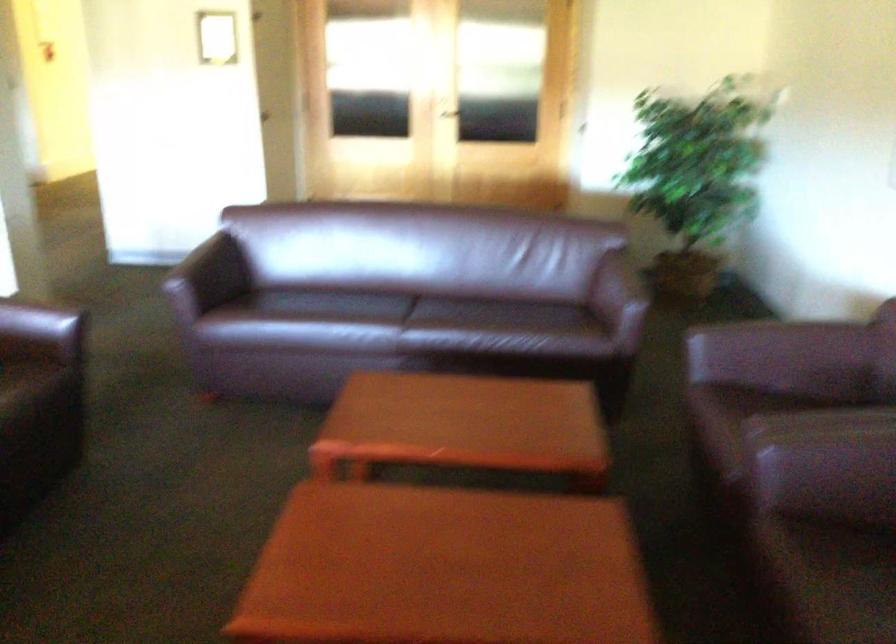
What do you see at coordinates (426, 310) in the screenshot?
I see `the sofa sitting surface` at bounding box center [426, 310].